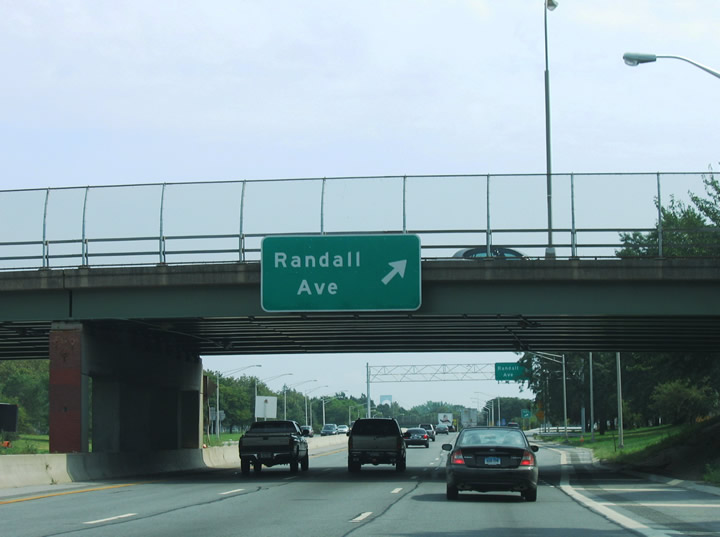
At what (x,y) coordinates should I click in order to perform the action: click on bed. Please return your answer as a coordinate pair (x, y). This screenshot has width=720, height=537. Looking at the image, I should click on (270, 442).